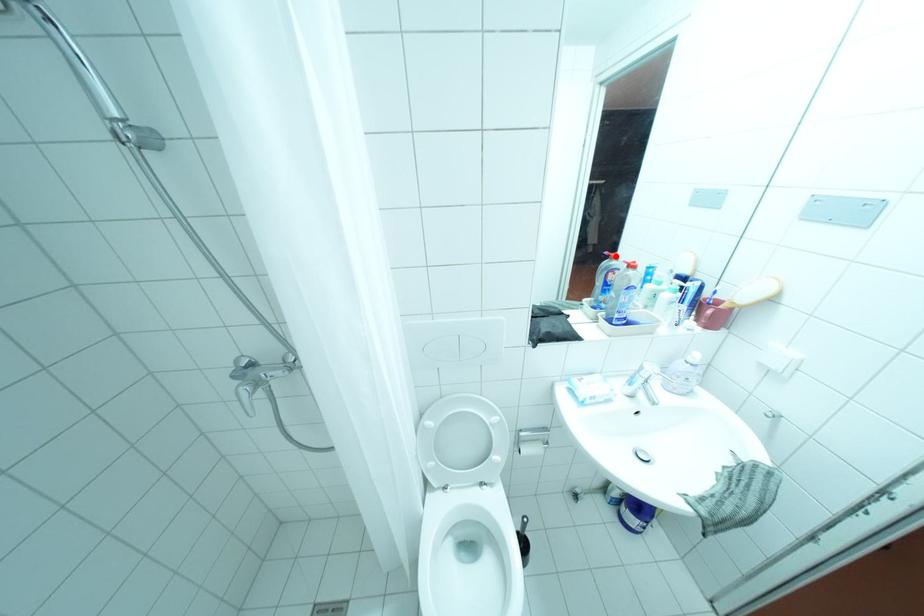
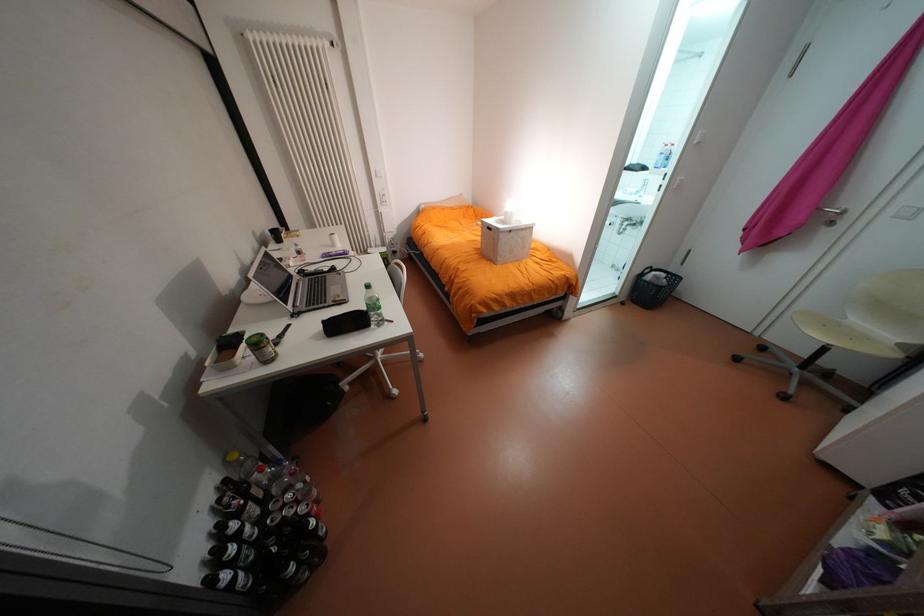
Question: I am providing you with two images of the same scene from different viewpoints. A red point is marked on the first image. At the location where the point appears in image 1, is it still visible in image 2?

Choices:
 (A) Yes
 (B) No

Answer: (B)